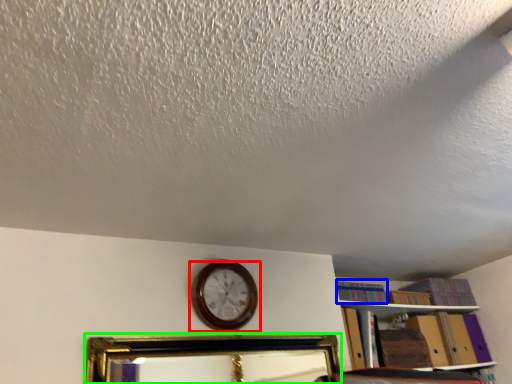
Question: Estimate the real-world distances between objects in this image. Which object is farther from wall clock (highlighted by a red box), book (highlighted by a blue box) or picture frame (highlighted by a green box)?

Choices:
 (A) book
 (B) picture frame

Answer: (B)